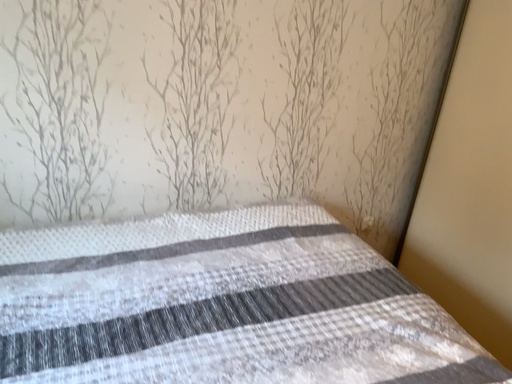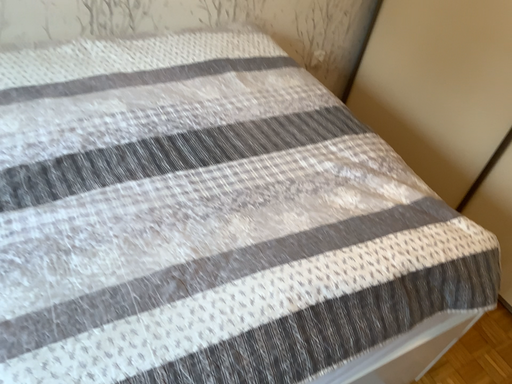
Question: Which way did the camera rotate in the video?

Choices:
 (A) rotated right
 (B) rotated left

Answer: (A)